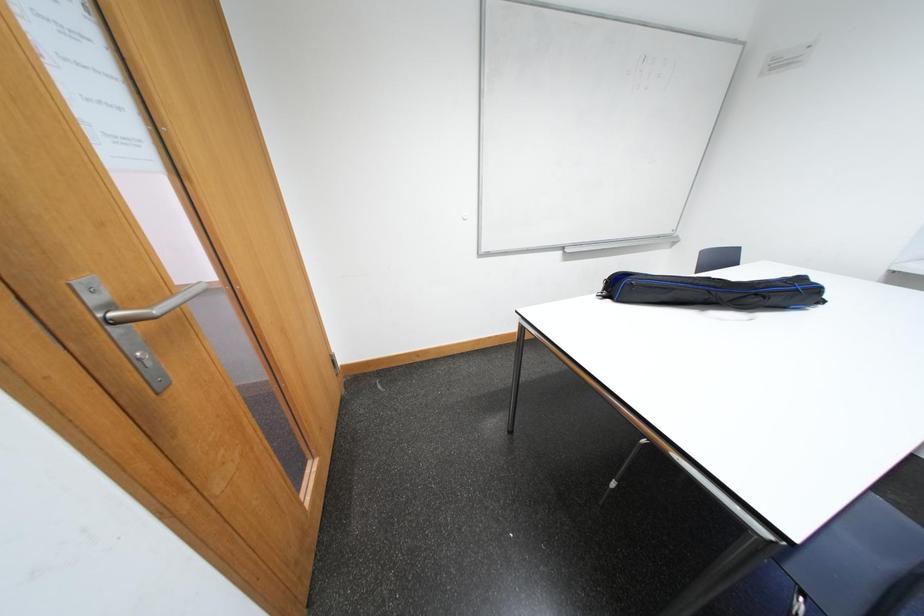
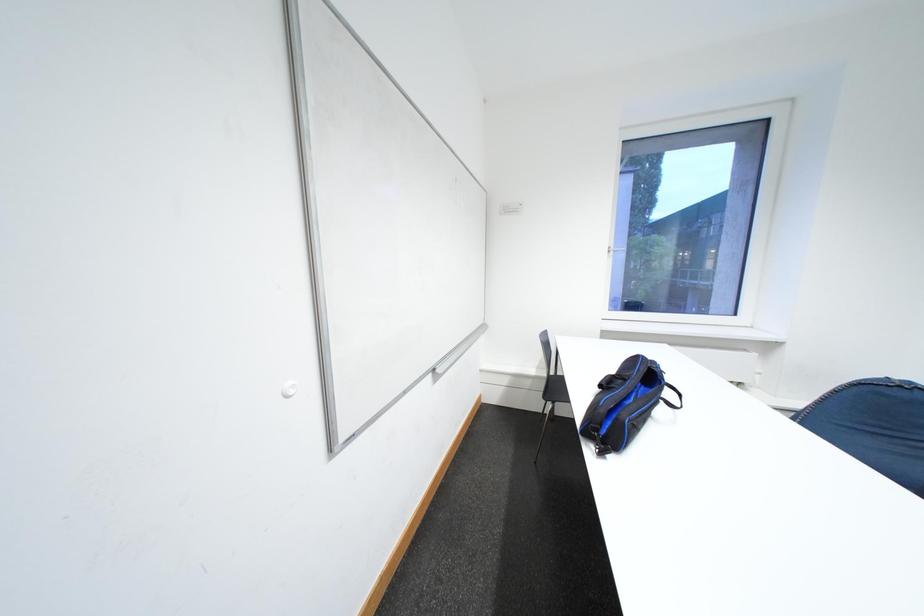
Question: Based on the continuous images, in which direction is the camera rotating? Reply with the corresponding letter.

Choices:
 (A) Left
 (B) Right
 (C) Up
 (D) Down

Answer: (B)